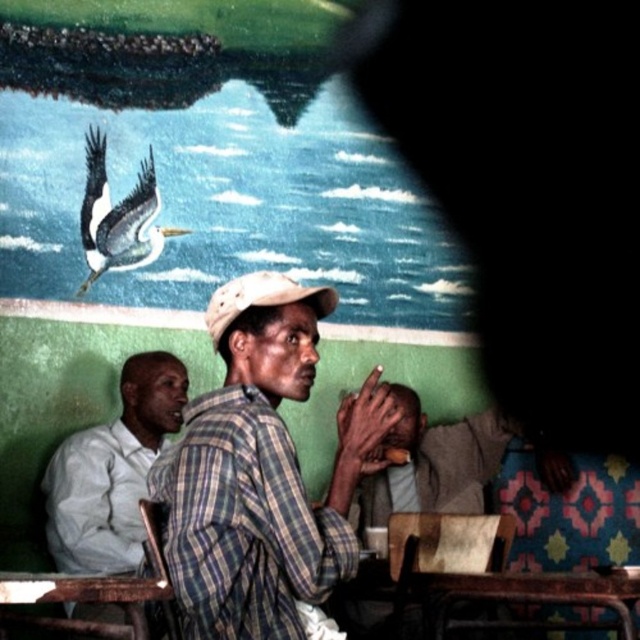
Question: Which point is farther to the camera?

Choices:
 (A) (128, 225)
 (B) (157, 593)

Answer: (A)

Question: Does plaid fabric shirt at center have a lesser width compared to white shirt at left?

Choices:
 (A) yes
 (B) no

Answer: (B)

Question: Which point appears farthest from the camera in this image?

Choices:
 (A) (134, 604)
 (B) (65, 492)
 (C) (93, 182)
 (D) (349, 557)

Answer: (C)

Question: Can you confirm if plaid fabric shirt at center is positioned to the right of white glossy pelican at upper center?

Choices:
 (A) yes
 (B) no

Answer: (A)

Question: Can you confirm if plaid fabric shirt at center is positioned below rusty metal table at lower left?

Choices:
 (A) yes
 (B) no

Answer: (B)

Question: Considering the real-world distances, which object is farthest from the rusty metal table at lower left?

Choices:
 (A) white glossy pelican at upper center
 (B) plaid fabric shirt at center
 (C) white shirt at left

Answer: (A)